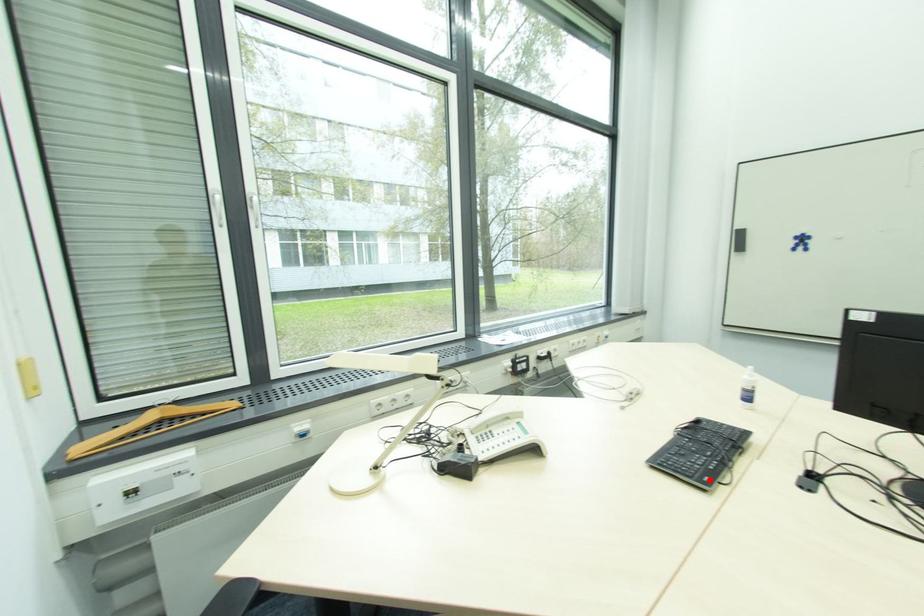
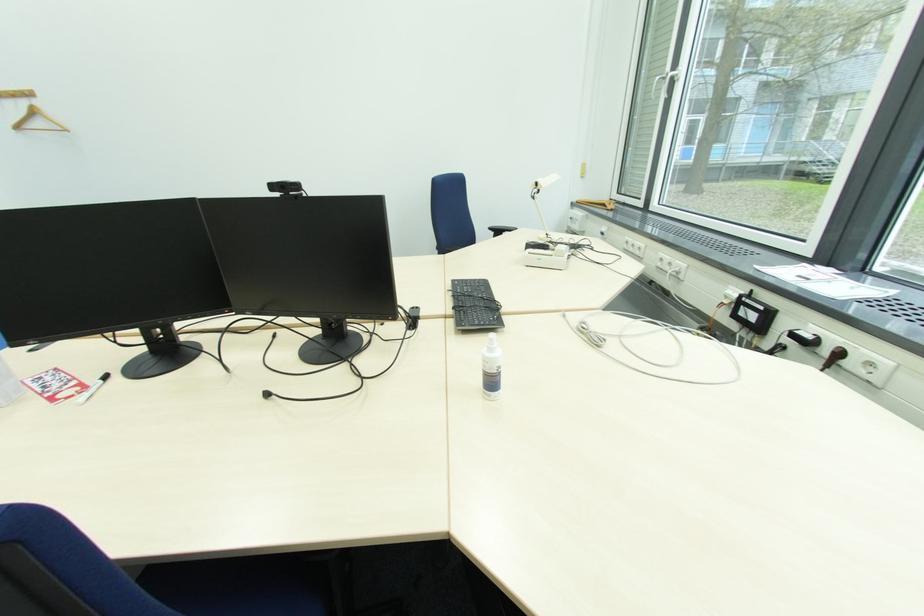
The point at the highlighted location is marked in the first image. Where is the corresponding point in the second image?

(459, 285)